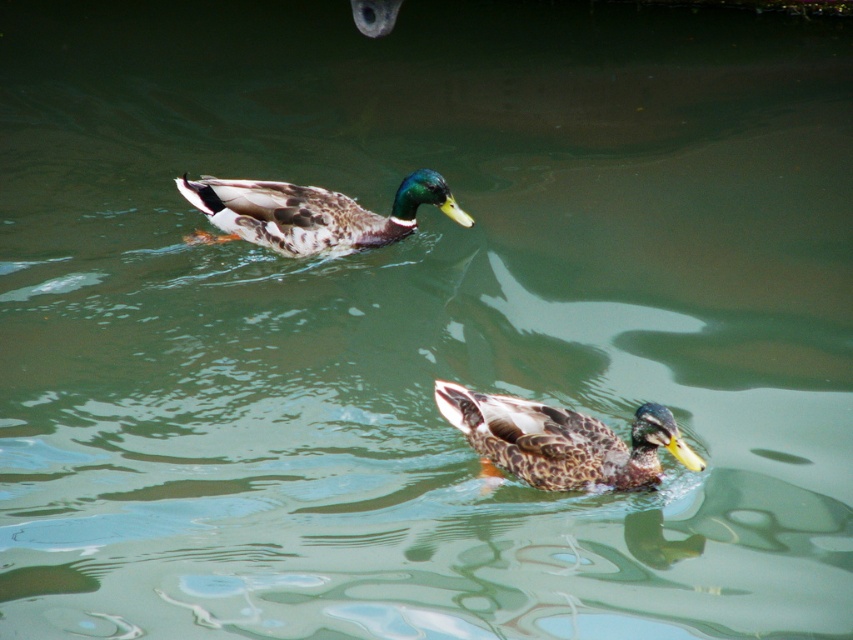
From the picture: Does speckled brown duck at center have a greater width compared to speckled feathered duck at upper center?

No, speckled brown duck at center is not wider than speckled feathered duck at upper center.

Does speckled brown duck at center appear on the right side of speckled feathered duck at upper center?

Yes, speckled brown duck at center is to the right of speckled feathered duck at upper center.

Find the location of a particular element. speckled brown duck at center is located at coordinates (561, 440).